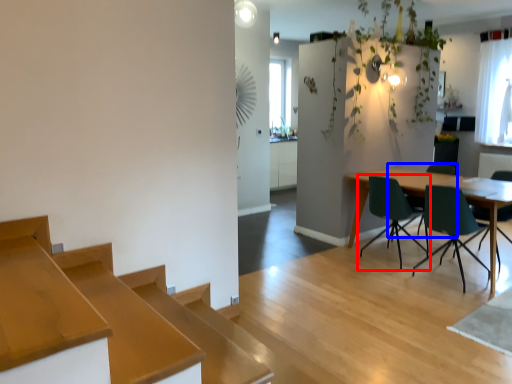
Question: Which object is further to the camera taking this photo, chair (highlighted by a red box) or chair (highlighted by a blue box)?

Choices:
 (A) chair
 (B) chair

Answer: (B)